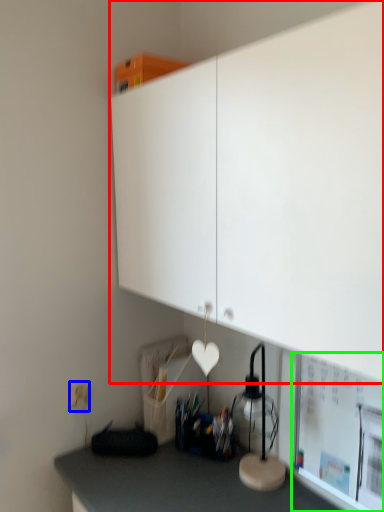
Question: Which object is the closest to the cabinetry (highlighted by a red box)? Choose among these: electric outlet (highlighted by a blue box) or bulletin board (highlighted by a green box).

Choices:
 (A) electric outlet
 (B) bulletin board

Answer: (B)